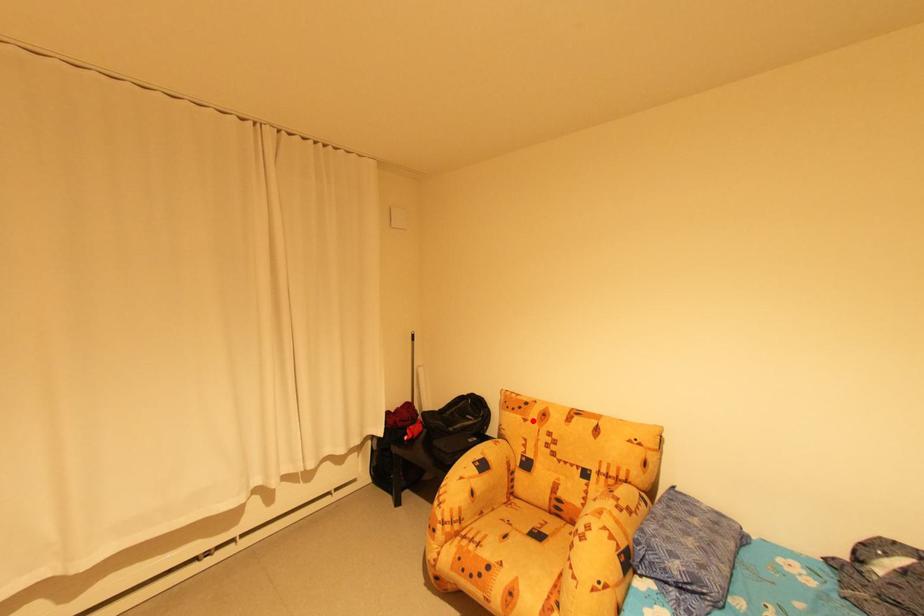
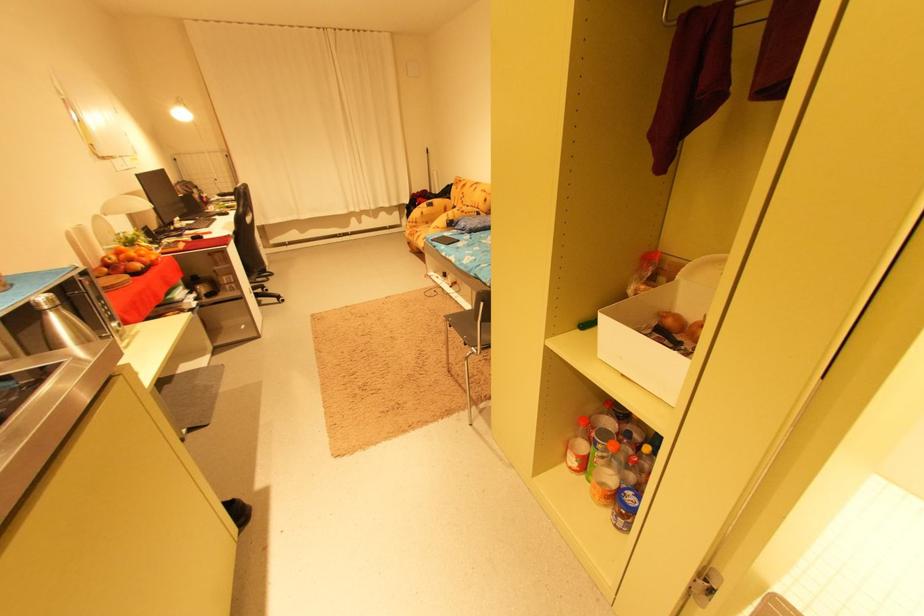
In the second image, find the point that corresponds to the highlighted location in the first image.

(464, 188)